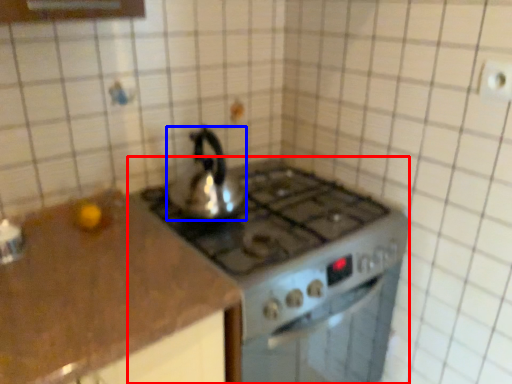
Question: Which point is further to the camera, gas stove (highlighted by a red box) or kettle (highlighted by a blue box)?

Choices:
 (A) gas stove
 (B) kettle

Answer: (B)